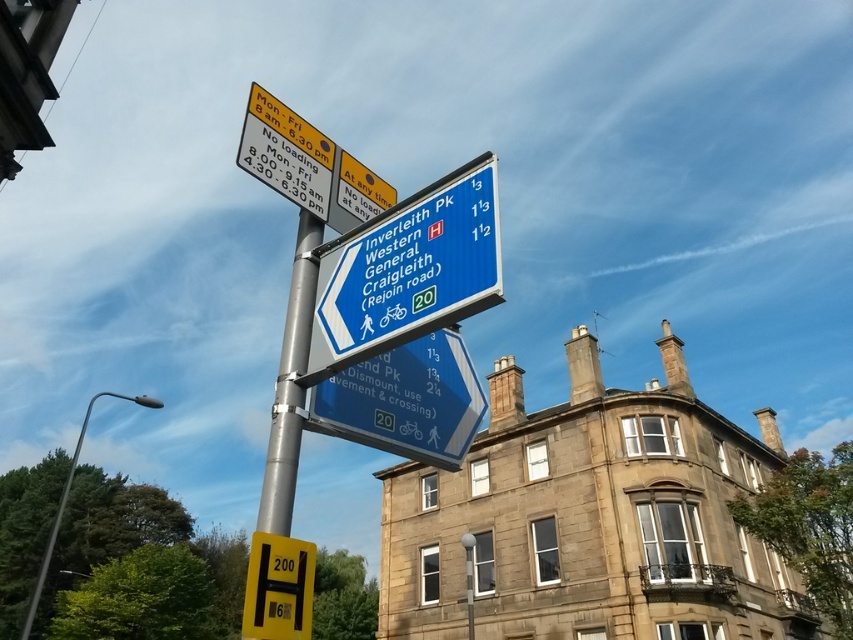
Does blue plastic road sign at upper center have a lesser width compared to blue plastic sign at upper center?

Incorrect, blue plastic road sign at upper center's width is not less than blue plastic sign at upper center's.

Does blue plastic road sign at upper center appear over blue plastic sign at upper center?

Yes.

Does point (479, 266) lie in front of point (451, 346)?

Yes.

What are the coordinates of `blue plastic road sign at upper center` in the screenshot? It's located at (408, 269).

Which of these two, silver metallic pole at center or yellow matte parking sign at lower left, stands taller?

silver metallic pole at center is taller.

Consider the image. Can you confirm if silver metallic pole at center is positioned above yellow matte parking sign at lower left?

Yes, silver metallic pole at center is above yellow matte parking sign at lower left.

Does point (312, 240) lie behind point (308, 605)?

That is True.

The width and height of the screenshot is (853, 640). I want to click on silver metallic pole at center, so click(289, 385).

Who is positioned more to the right, blue plastic sign at upper center or silver metallic pole at center?

blue plastic sign at upper center is more to the right.

The height and width of the screenshot is (640, 853). What do you see at coordinates (405, 401) in the screenshot?
I see `blue plastic sign at upper center` at bounding box center [405, 401].

Find the location of a particular element. The height and width of the screenshot is (640, 853). blue plastic sign at upper center is located at coordinates (405, 401).